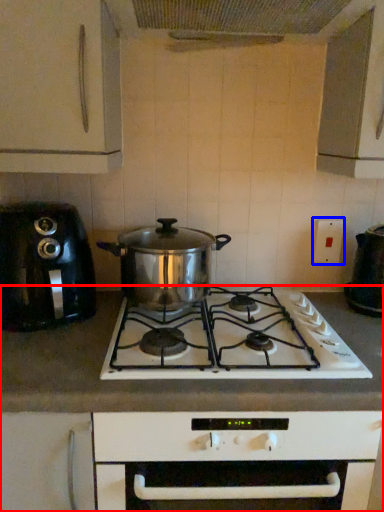
Question: Which point is closer to the camera, countertop (highlighted by a red box) or electric outlet (highlighted by a blue box)?

Choices:
 (A) countertop
 (B) electric outlet

Answer: (A)